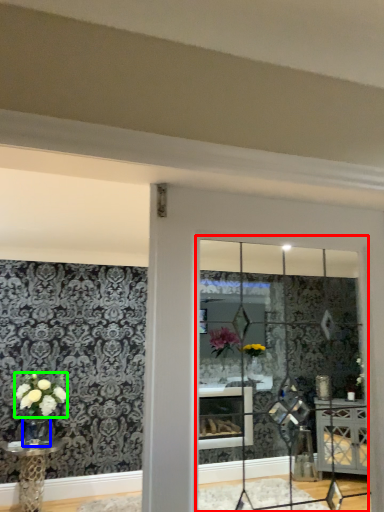
Question: Which object is the closest to the glass window (highlighted by a red box)? Choose among these: glass vase (highlighted by a blue box) or flower (highlighted by a green box).

Choices:
 (A) glass vase
 (B) flower

Answer: (B)